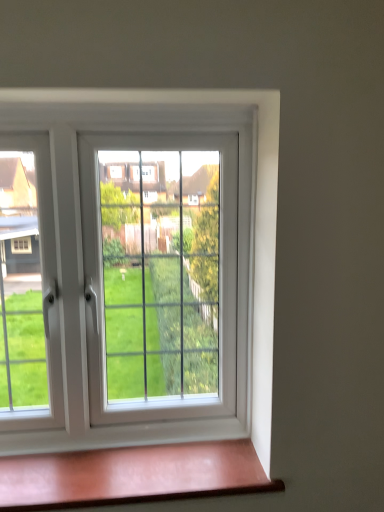
I want to click on blank space situated above matte pink wood at lower center (from a real-world perspective), so click(131, 465).